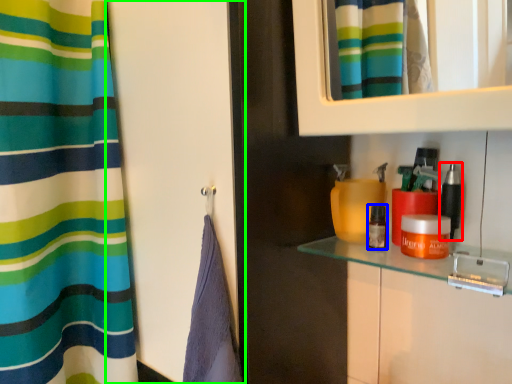
Question: Considering the real-world distances, which object is closest to cosmetic (highlighted by a red box)? cosmetic (highlighted by a blue box) or screen door (highlighted by a green box).

Choices:
 (A) cosmetic
 (B) screen door

Answer: (A)